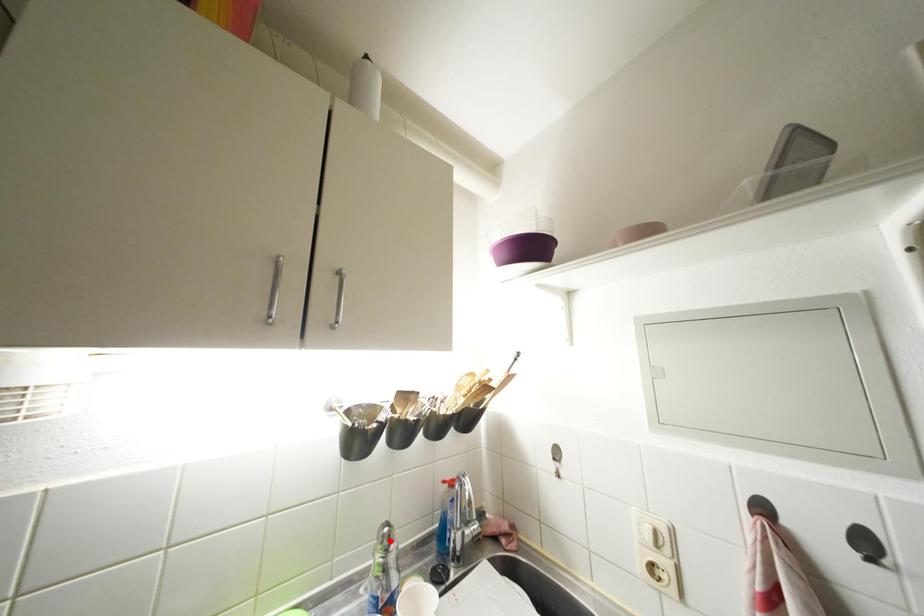
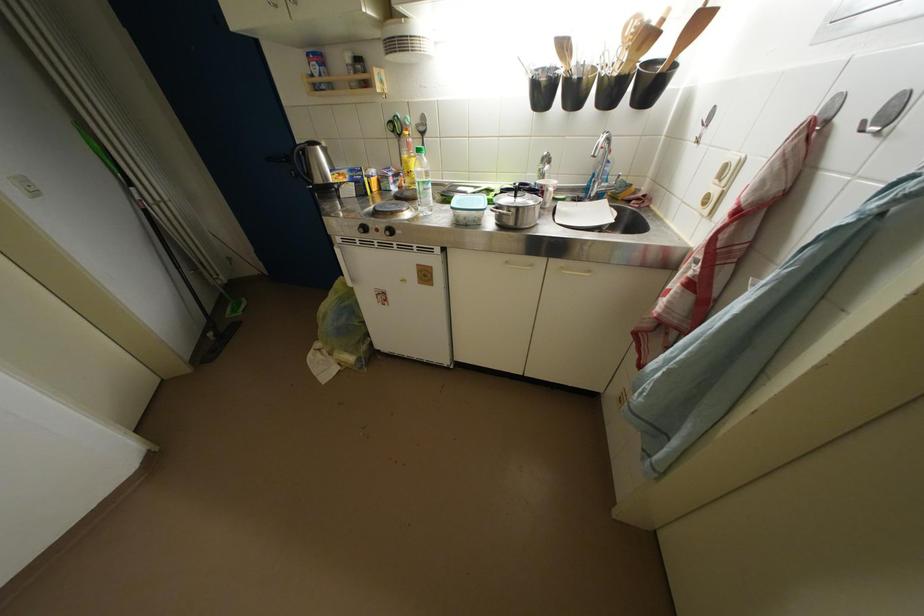
Where in the second image is the point corresponding to the highlighted location from the first image?

(551, 161)